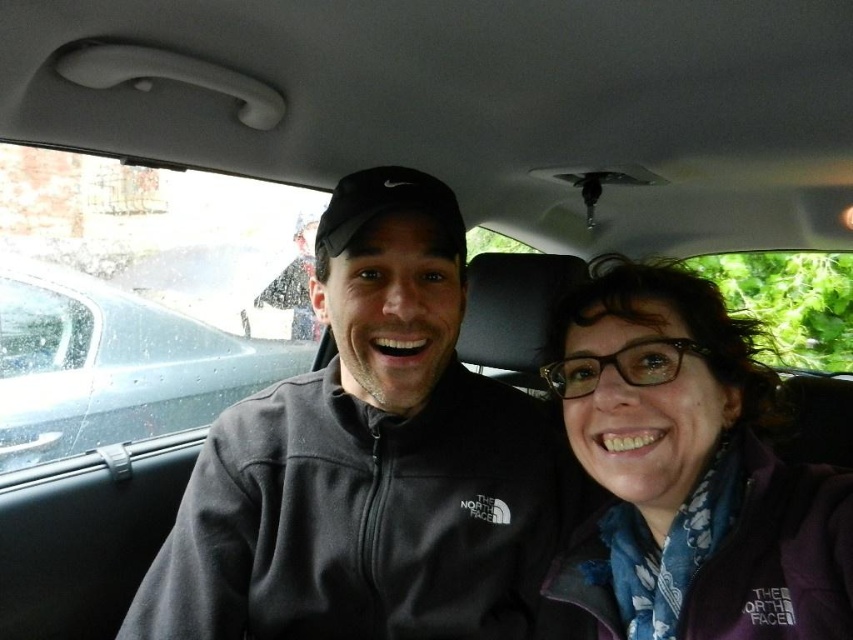
Consider the image. You are a photographer trying to capture a clear photo of the dark gray fleece jacket at center. The camera you are using has a minimum focusing distance of 30 inches. Will you be able to take a clear photo of the jacket without moving closer?

The dark gray fleece jacket at center is 33.42 inches from the camera, which is beyond the minimum focusing distance of 30 inches. Therefore, you can take a clear photo of the jacket without moving closer.

You are a photographer trying to capture a photo of the purple fleece jacket at center and the metallic gray car at left. Based on their sizes in the image, which object would appear smaller in the final photo?

The purple fleece jacket at center appears smaller in the photo because it is not as tall as the metallic gray car at left, meaning the car is larger and would take up more space in the image.

You are a passenger in the car and want to hand a jacket to the driver. Which object should you pass through first, the dark gray fleece jacket at center or the metallic gray car at left?

The dark gray fleece jacket at center is in front of the metallic gray car at left, so you should pass through the dark gray fleece jacket at center first.